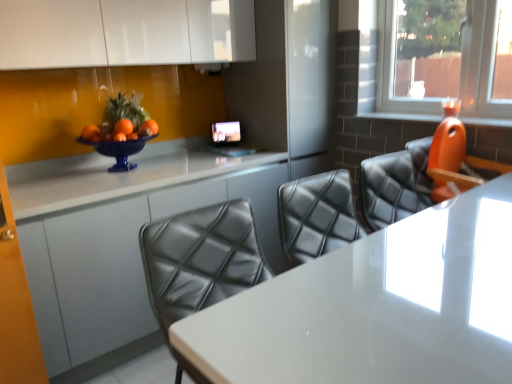
The width and height of the screenshot is (512, 384). What are the coordinates of `white glossy table at center` in the screenshot? It's located at (377, 307).

Where is `white glossy table at center`? white glossy table at center is located at coordinates (377, 307).

Is transparent glass candle at upper right spatially inside orange plastic chair at right, or outside of it?

The correct answer is: outside.

In order to click on window lying on the right of orange plastic chair at right in this screenshot , I will do `click(435, 57)`.

Considering the sizes of objects transparent glass candle at upper right and orange plastic chair at right in the image provided, who is shorter, transparent glass candle at upper right or orange plastic chair at right?

Standing shorter between the two is orange plastic chair at right.

From a real-world perspective, is transparent glass candle at upper right above or below orange plastic chair at right?

Clearly, from a real-world perspective, transparent glass candle at upper right is above orange plastic chair at right.

Is white glossy counter at center next to orange plastic chair at right and touching it?

There is a gap between white glossy counter at center and orange plastic chair at right.

Is white glossy counter at center oriented towards orange plastic chair at right?

Yes, white glossy counter at center is aimed at orange plastic chair at right.

Where is `counter that is under the orange plastic chair at right (from a real-world perspective)`? This screenshot has height=384, width=512. counter that is under the orange plastic chair at right (from a real-world perspective) is located at coordinates (120, 236).

Which is farther from the camera, (141, 315) or (383, 219)?

The point (141, 315) is behind.

Does transparent glass candle at upper right contain white glossy table at center?

Definitely not — white glossy table at center is not inside transparent glass candle at upper right.

Is white glossy table at center at the back of transparent glass candle at upper right?

No, white glossy table at center is not at the back of transparent glass candle at upper right.

Can you tell me how much transparent glass candle at upper right and white glossy table at center differ in facing direction?

90.3 degrees.

From the image's perspective, does transparent glass candle at upper right appear lower than white glossy table at center?

No, from the image's perspective, transparent glass candle at upper right is not below white glossy table at center.

Based on the photo, from a real-world perspective, which is physically above, white glossy table at center or orange plastic chair at right?

orange plastic chair at right is physically above.

Is white glossy table at center in front of or behind orange plastic chair at right in the image?

Visually, white glossy table at center is located in front of orange plastic chair at right.

Is white glossy table at center wider or thinner than orange plastic chair at right?

In the image, white glossy table at center appears to be wider than orange plastic chair at right.

Would you say white glossy table at center is outside orange plastic chair at right?

Yes.

Considering the sizes of objects white glossy counter at center and white glossy table at center in the image provided, who is thinner, white glossy counter at center or white glossy table at center?

white glossy table at center.

Which of these two, white glossy counter at center or white glossy table at center, is bigger?

With larger size is white glossy table at center.

From a real-world perspective, is white glossy counter at center located higher than white glossy table at center?

No, from a real-world perspective, white glossy counter at center is not on top of white glossy table at center.

What's the angular difference between transparent glass candle at upper right and white glossy counter at center's facing directions?

The facing directions of transparent glass candle at upper right and white glossy counter at center are 90.1 degrees apart.

In the scene shown: Between transparent glass candle at upper right and white glossy counter at center, which one has larger size?

white glossy counter at center.

From a real-world perspective, is transparent glass candle at upper right above or below white glossy counter at center?

A: transparent glass candle at upper right is above white glossy counter at center.

Is transparent glass candle at upper right in contact with white glossy counter at center?

No, transparent glass candle at upper right is not in contact with white glossy counter at center.

From a real-world perspective, is white glossy table at center above or below transparent glass candle at upper right?

In terms of real-world spatial position, white glossy table at center is below transparent glass candle at upper right.

From the image's perspective, which object appears higher, white glossy table at center or transparent glass candle at upper right?

transparent glass candle at upper right, from the image's perspective.

Is white glossy table at center smaller than transparent glass candle at upper right?

Actually, white glossy table at center might be larger than transparent glass candle at upper right.

Where is `chair in front of the transparent glass candle at upper right`? chair in front of the transparent glass candle at upper right is located at coordinates (396, 184).

You are a GUI agent. You are given a task and a screenshot of the screen. Output one action in this format:
    pyautogui.click(x=<x>, y=<y>)
    Task: Click on the counter behind the orange plastic chair at right
    The width and height of the screenshot is (512, 384).
    Given the screenshot: What is the action you would take?
    pyautogui.click(x=120, y=236)

Which object lies further to the anchor point transparent glass candle at upper right, white glossy counter at center or white glossy table at center?

white glossy table at center.

When comparing their distances from orange plastic chair at right, does white glossy table at center or white glossy counter at center seem closer?

The object closer to orange plastic chair at right is white glossy table at center.

Estimate the real-world distances between objects in this image. Which object is closer to transparent glass candle at upper right, white glossy table at center or orange plastic chair at right?

Result: The object closer to transparent glass candle at upper right is orange plastic chair at right.

Looking at the image, which one is located further to orange plastic chair at right, white glossy counter at center or white glossy table at center?

The object further to orange plastic chair at right is white glossy counter at center.

Which object lies nearer to the anchor point white glossy counter at center, white glossy table at center or orange plastic chair at right?

orange plastic chair at right.

Based on their spatial positions, is orange plastic chair at right or white glossy counter at center further from white glossy table at center?

white glossy counter at center.

When comparing their distances from transparent glass candle at upper right, does orange plastic chair at right or white glossy counter at center seem closer?

orange plastic chair at right.

Which object lies nearer to the anchor point white glossy table at center, white glossy counter at center or transparent glass candle at upper right?

Based on the image, white glossy counter at center appears to be nearer to white glossy table at center.

The width and height of the screenshot is (512, 384). I want to click on chair between white glossy table at center and transparent glass candle at upper right along the z-axis, so click(396, 184).

Find the location of a particular element. table located between white glossy counter at center and orange plastic chair at right in the left-right direction is located at coordinates (377, 307).

Locate an element on the screen. The width and height of the screenshot is (512, 384). chair between white glossy counter at center and transparent glass candle at upper right in the horizontal direction is located at coordinates (396, 184).

Identify the location of table between white glossy counter at center and transparent glass candle at upper right from left to right. (377, 307).